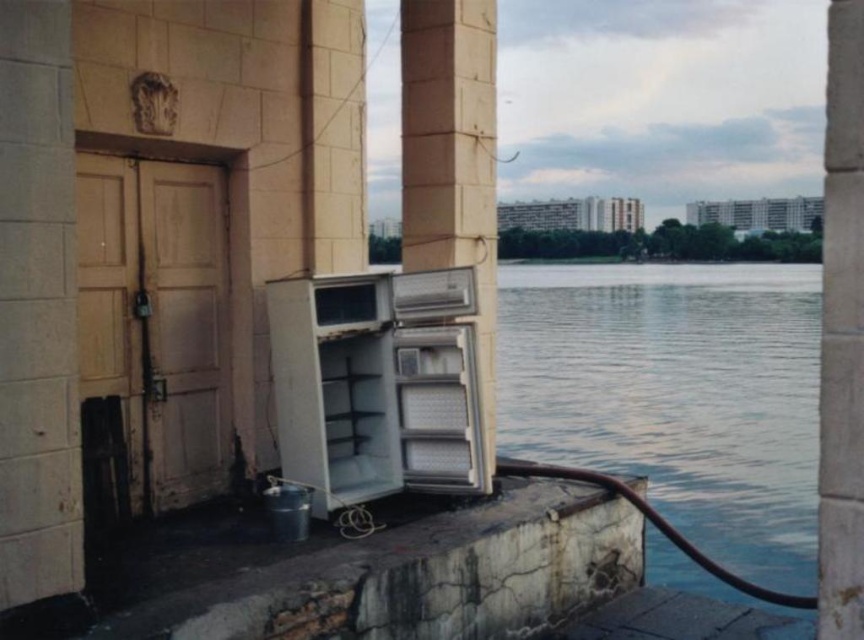
Does white plastic refrigerator at lower left have a lesser height compared to smooth concrete pillar at right?

Correct, white plastic refrigerator at lower left is not as tall as smooth concrete pillar at right.

Does point (392, 420) lie in front of point (847, 554)?

No, (392, 420) is further to viewer.

Identify the location of white plastic refrigerator at lower left. (376, 385).

Does white plastic refrigerator at center have a larger size compared to smooth concrete pillar at right?

No, white plastic refrigerator at center is not bigger than smooth concrete pillar at right.

Is white plastic refrigerator at center wider than smooth concrete pillar at right?

No.

This screenshot has height=640, width=864. What do you see at coordinates (452, 157) in the screenshot?
I see `white plastic refrigerator at center` at bounding box center [452, 157].

Where is `white plastic refrigerator at center`? white plastic refrigerator at center is located at coordinates (452, 157).

Can you confirm if white plastic refrigerator at lower left is thinner than white plastic refrigerator at center?

Incorrect, white plastic refrigerator at lower left's width is not less than white plastic refrigerator at center's.

Who is positioned more to the right, white plastic refrigerator at lower left or white plastic refrigerator at center?

white plastic refrigerator at center

Is point (342, 349) closer to camera compared to point (429, 204)?

Yes, it is in front of point (429, 204).

Identify the location of white plastic refrigerator at lower left. (376, 385).